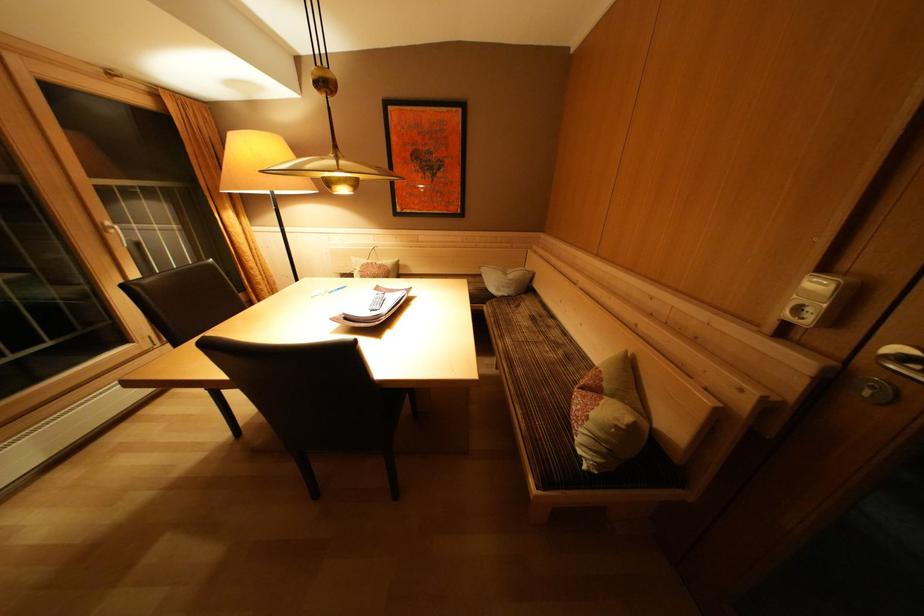
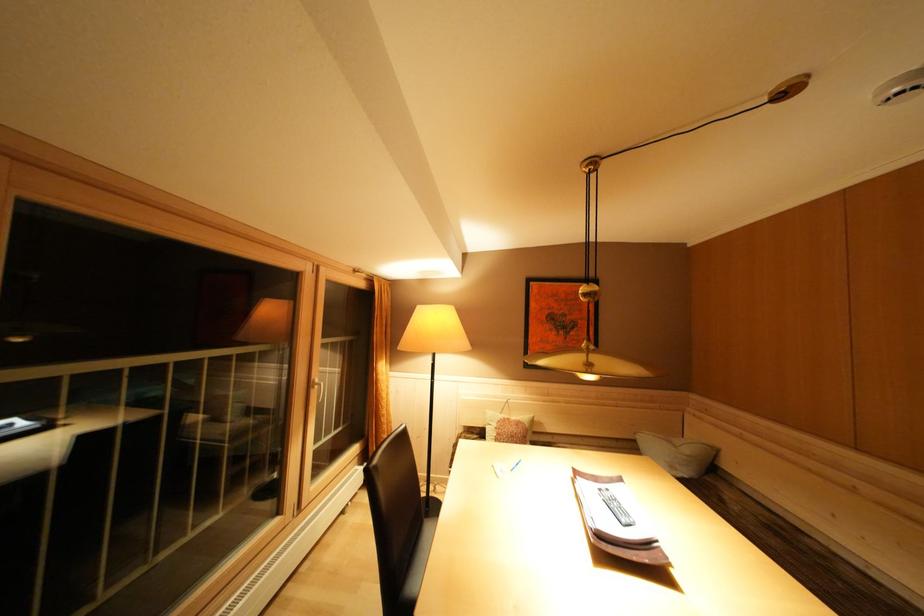
Find the pixel in the second image that matches (x=116, y=229) in the first image.

(323, 386)